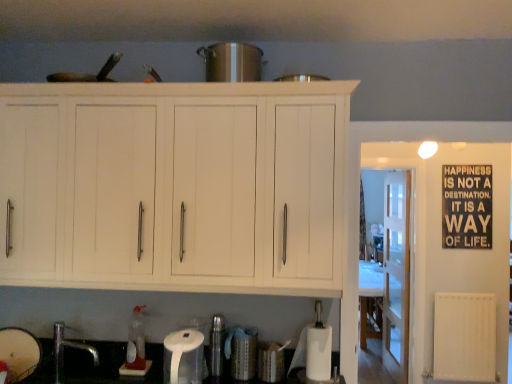
Question: Considering the positions of matte white bowl at lower left, the third appliance in the top-to-bottom sequence, and metallic silver canister at lower center, positioned as the 2th appliance in top-to-bottom order, in the image, is matte white bowl at lower left, the third appliance in the top-to-bottom sequence, wider or thinner than metallic silver canister at lower center, positioned as the 2th appliance in top-to-bottom order,?

Choices:
 (A) thin
 (B) wide

Answer: (B)

Question: From a real-world perspective, is matte white bowl at lower left, the fourth appliance from the right, above or below metallic silver canister at lower center, which is the third appliance from bottom to top?

Choices:
 (A) above
 (B) below

Answer: (B)

Question: Which object is the farthest from the silver metallic faucet at lower left?

Choices:
 (A) matte white bowl at lower left, the fourth appliance from the right
 (B) black matte signboard at upper right
 (C) white matte paper towel at lower center
 (D) white plastic radiator at right
 (E) clear glass door at center

Answer: (B)

Question: Estimate the real-world distances between objects in this image. Which object is farther from the white plastic radiator at right?

Choices:
 (A) silver metallic faucet at lower left
 (B) black matte signboard at upper right
 (C) matte white bowl at lower left, which is the 1th appliance from left to right
 (D) white wood cabinet at upper center
 (E) shiny metallic pot at center, marked as the 3th appliance in a left-to-right arrangement

Answer: (C)